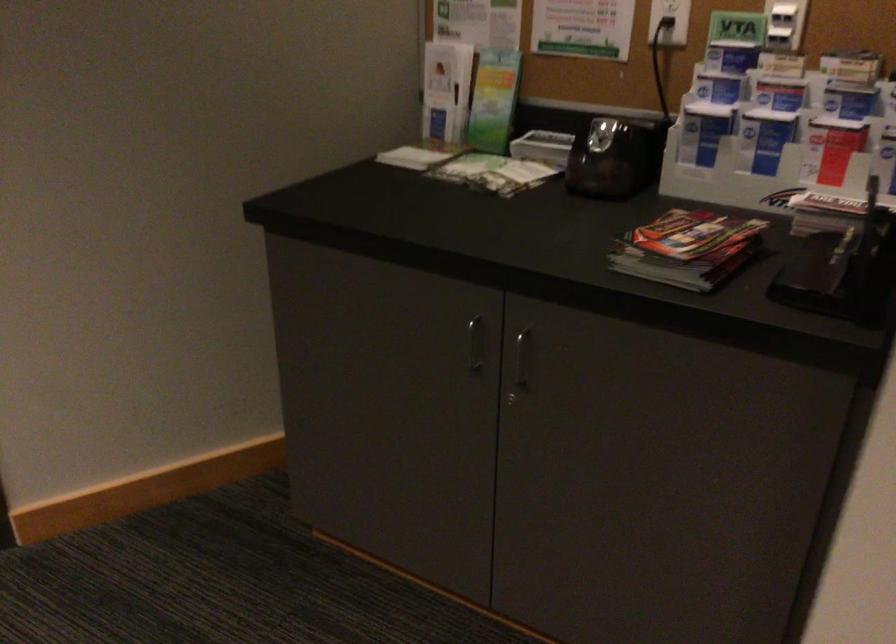
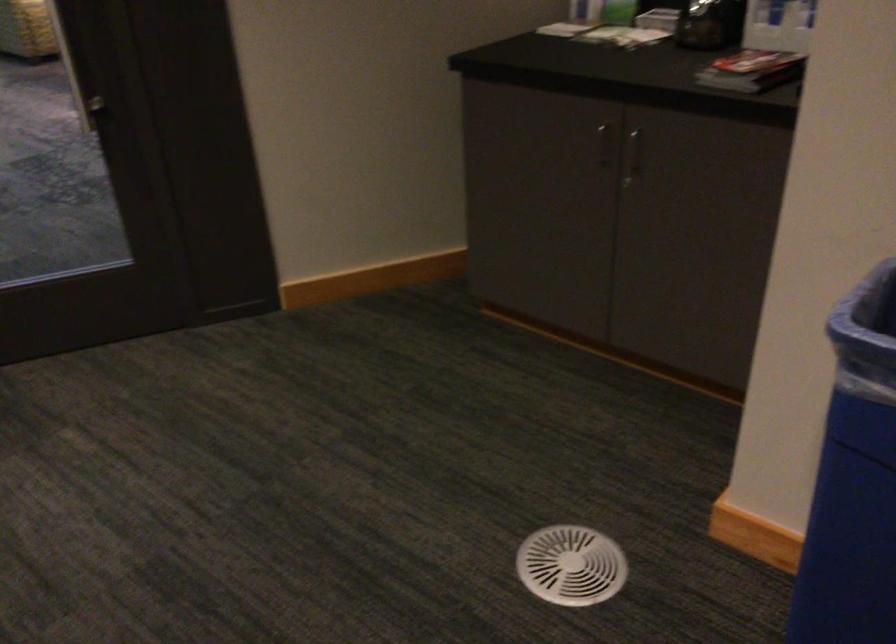
In the second image, find the point that corresponds to point (698, 259) in the first image.

(751, 71)